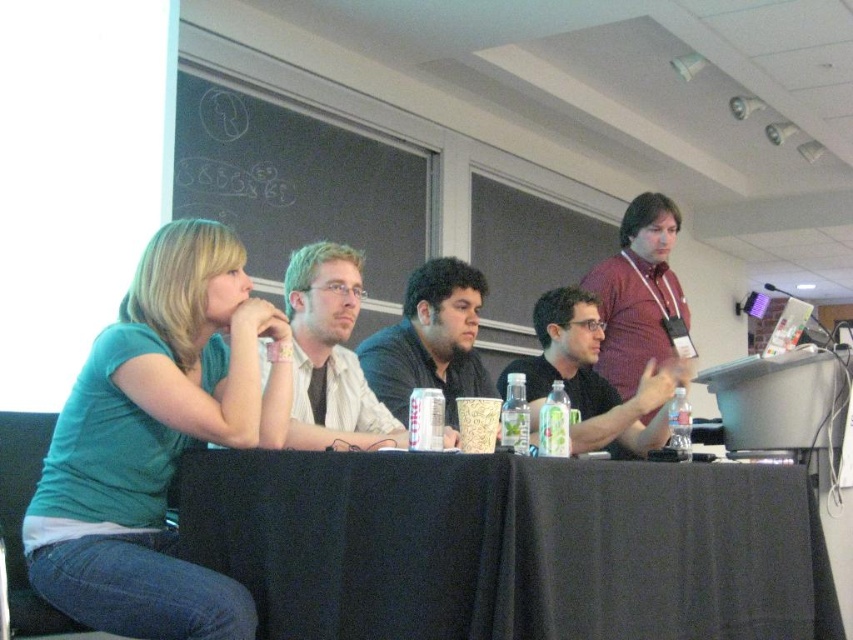
You are organizing a meeting and need to place a large document on the table. Given the sizes of the objects in the scene, will the black fabric table at center have enough space to accommodate the document without overlapping the teal matte shirt at left?

The black fabric table at center is larger in size than the teal matte shirt at left, so there should be sufficient space to place the large document on the table without overlapping the shirt.

Based on the photo, you are standing in the conference room and want to place a 3.56 feet wide tablecloth on the table. The existing tablecloth covers the table except for a spot at point (350, 436). Will the new tablecloth cover that spot?

The point (350, 436) is 6.56 feet from the viewer. The new tablecloth is 3.56 feet wide, so it may not be wide enough to cover the spot unless positioned precisely. However, without knowing the table length or exact placement, it is uncertain. But since the distance from the viewer is greater than the tablecloth width, it likely cannot reach.